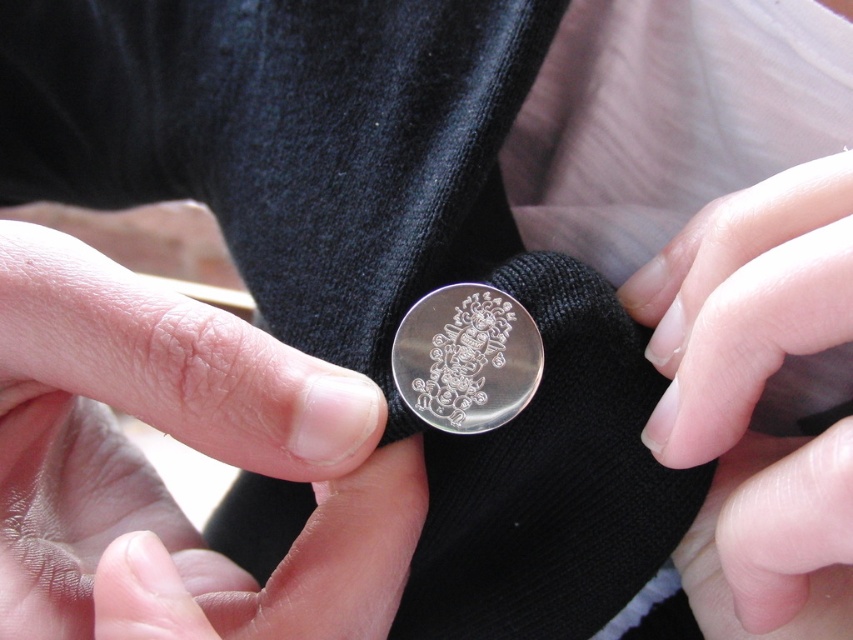
You are a jeweler examining two items displayed on a velvet cloth. You have a nail polish at center and a silver polished coin at center. Which item is taller?

The nail polish at center is taller than the silver polished coin at center.

You are a treasure hunter who found a map with coordinates. The map says there is a treasure at point 0.695, 0.219. You are looking at the image of the black fabric with the smooth silver coin at center. Where should you look on the fabric to find the treasure?

The treasure is located at the smooth silver coin at center because it is exactly at point (186, 444).

You are holding a smooth silver coin at center with your hand. If your hand is 4 inches wide, can you completely cover the coin with your hand?

The smooth silver coin at center is 9.50 inches away from the viewer. Since your hand is only 4 inches wide, you cannot completely cover the smooth silver coin at center because it is farther away than the hand can reach.